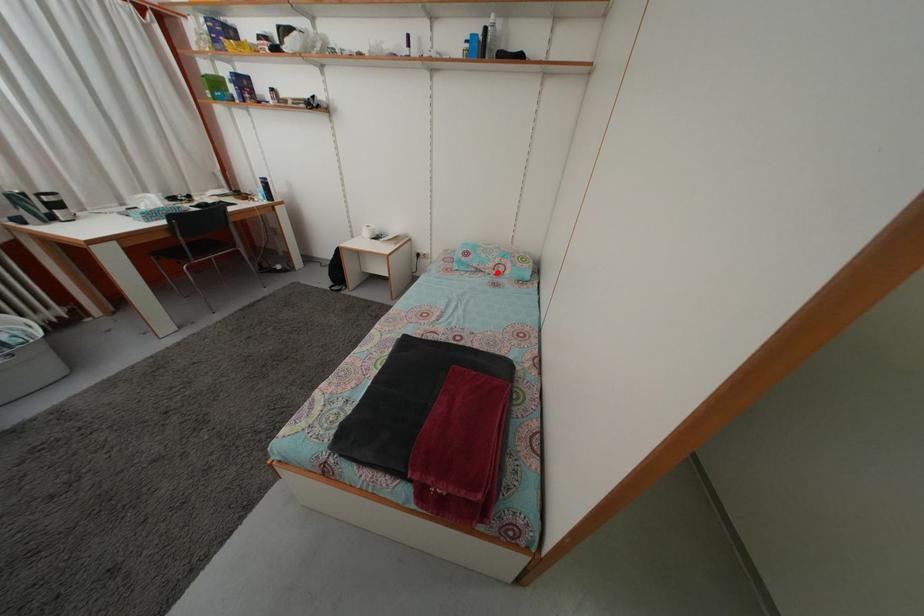
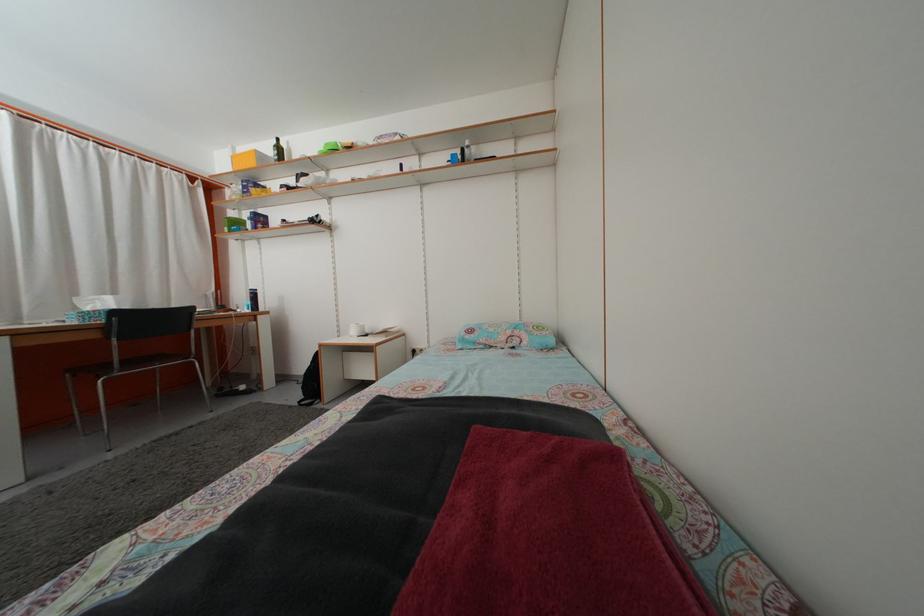
Question: I am providing you with two images of the same scene from different viewpoints. In image1, a red point is highlighted. Considering the same 3D point in image2, which of the following is correct?

Choices:
 (A) It is closer
 (B) It is farther

Answer: (B)